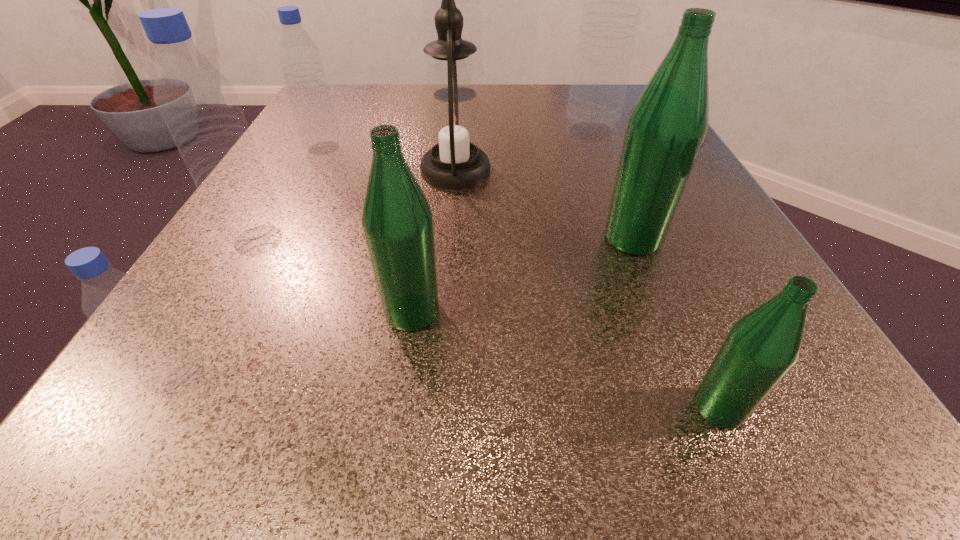
Locate an element on the screen. The image size is (960, 540). free space between the farthest object and the smallest green bottle is located at coordinates (587, 251).

The height and width of the screenshot is (540, 960). In order to click on blank region between the second smallest blue bottle and the farthest blue bottle in this screenshot , I will do `click(390, 121)`.

Locate an element on the screen. This screenshot has width=960, height=540. free space between the nearest blue bottle and the second smallest blue bottle is located at coordinates (253, 265).

Find the location of a particular element. The height and width of the screenshot is (540, 960). vacant space that is in between the second smallest green bottle and the second nearest blue bottle is located at coordinates (335, 275).

Locate an element on the screen. Image resolution: width=960 pixels, height=540 pixels. unoccupied position between the fourth smallest blue bottle and the third biggest blue bottle is located at coordinates (424, 185).

The width and height of the screenshot is (960, 540). I want to click on free space between the farthest object and the nearest green bottle, so (587, 251).

Image resolution: width=960 pixels, height=540 pixels. I want to click on free spot between the leftmost green bottle and the nearest blue bottle, so click(x=297, y=346).

Image resolution: width=960 pixels, height=540 pixels. In order to click on free point between the farthest blue bottle and the second smallest blue bottle in this screenshot , I will do `click(390, 121)`.

Identify the location of free space that is in between the farthest object and the second smallest blue bottle. Image resolution: width=960 pixels, height=540 pixels. point(390,121).

Point out which object is positioned as the fifth nearest to the biggest green bottle. Please provide its 2D coordinates. Your answer should be formatted as a tuple, i.e. [(x, y)], where the tuple contains the x and y coordinates of a point satisfying the conditions above.

[(198, 104)]